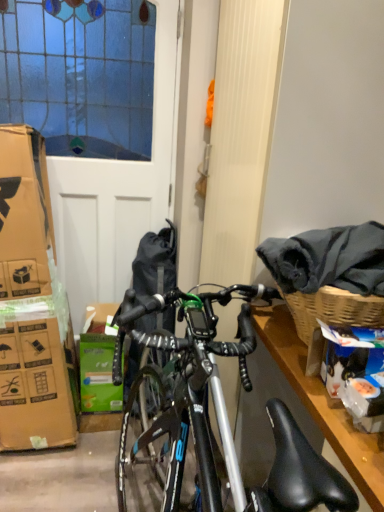
Describe the element at coordinates (86, 141) in the screenshot. I see `white matte screen door at left` at that location.

This screenshot has height=512, width=384. Find the location of `white matte screen door at left`. white matte screen door at left is located at coordinates (86, 141).

In order to face white matte screen door at left, should I rotate leftwards or rightwards?

To align with it, rotate left about 13.569°.

This screenshot has height=512, width=384. What do you see at coordinates (98, 375) in the screenshot? I see `green cardboard box at center` at bounding box center [98, 375].

At what (x,y) coordinates should I click in order to perform the action: click on green cardboard box at center. Please return your answer as a coordinate pair (x, y). This screenshot has height=512, width=384. Looking at the image, I should click on (98, 375).

What are the coordinates of `white matte screen door at left` in the screenshot? It's located at (86, 141).

Would you say white matte screen door at left is to the left or to the right of green cardboard box at center in the picture?

Clearly, white matte screen door at left is on the left of green cardboard box at center in the image.

Is the position of white matte screen door at left more distant than that of green cardboard box at center?

No, white matte screen door at left is closer to the viewer.

Is point (107, 63) less distant than point (114, 341)?

Yes, it is in front of point (114, 341).

From the image's perspective, is white matte screen door at left positioned above or below green cardboard box at center?

From the image's perspective, white matte screen door at left appears above green cardboard box at center.

From a real-world perspective, which object rests below the other?

green cardboard box at center, from a real-world perspective.

Does white matte screen door at left have a lesser width compared to green cardboard box at center?

Yes, white matte screen door at left is thinner than green cardboard box at center.

Considering the relative sizes of white matte screen door at left and green cardboard box at center in the image provided, is white matte screen door at left taller than green cardboard box at center?

Yes.

Which of these two, white matte screen door at left or green cardboard box at center, is smaller?

green cardboard box at center is smaller.

Would you say white matte screen door at left is inside or outside green cardboard box at center?

white matte screen door at left is located beyond the bounds of green cardboard box at center.

Is there a large distance between white matte screen door at left and green cardboard box at center?

No, white matte screen door at left is in close proximity to green cardboard box at center.

Is white matte screen door at left looking in the opposite direction of green cardboard box at center?

Yes, white matte screen door at left is positioned with its back facing green cardboard box at center.

This screenshot has width=384, height=512. I want to click on screen door on the left side of green cardboard box at center, so click(86, 141).

Does green cardboard box at center appear on the left side of white matte screen door at left?

No.

In the image, is green cardboard box at center positioned in front of or behind white matte screen door at left?

green cardboard box at center is behind white matte screen door at left.

Which point is more forward, (x=108, y=400) or (x=62, y=124)?

Positioned in front is point (x=62, y=124).

From the image's perspective, relative to white matte screen door at left, is green cardboard box at center above or below?

green cardboard box at center is below white matte screen door at left.

From a real-world perspective, who is located higher, green cardboard box at center or white matte screen door at left?

white matte screen door at left is physically above.

Between green cardboard box at center and white matte screen door at left, which one has larger width?

green cardboard box at center is wider.

Can you confirm if green cardboard box at center is taller than white matte screen door at left?

No.

In terms of size, does green cardboard box at center appear bigger or smaller than white matte screen door at left?

In the image, green cardboard box at center appears to be smaller than white matte screen door at left.

Choose the correct answer: Is green cardboard box at center inside white matte screen door at left or outside it?

green cardboard box at center lies outside white matte screen door at left.

Is green cardboard box at center far from white matte screen door at left?

No, green cardboard box at center is not far from white matte screen door at left.

Is green cardboard box at center looking in the opposite direction of white matte screen door at left?

Yes, green cardboard box at center is facing away from white matte screen door at left.

What's the angular difference between green cardboard box at center and white matte screen door at left's facing directions?

green cardboard box at center and white matte screen door at left are facing 0.266 degrees away from each other.

Find the location of a particular element. The height and width of the screenshot is (512, 384). screen door in front of the green cardboard box at center is located at coordinates (86, 141).

Image resolution: width=384 pixels, height=512 pixels. Find the location of `screen door above the green cardboard box at center (from the image's perspective)`. screen door above the green cardboard box at center (from the image's perspective) is located at coordinates (86, 141).

Identify the location of box behind the white matte screen door at left. tap(98, 375).